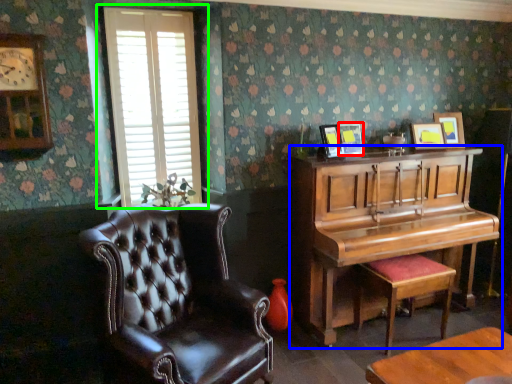
Question: Which object is positioned farthest from picture frame (highlighted by a red box)? Select from piano (highlighted by a blue box) and window (highlighted by a green box).

Choices:
 (A) piano
 (B) window

Answer: (B)